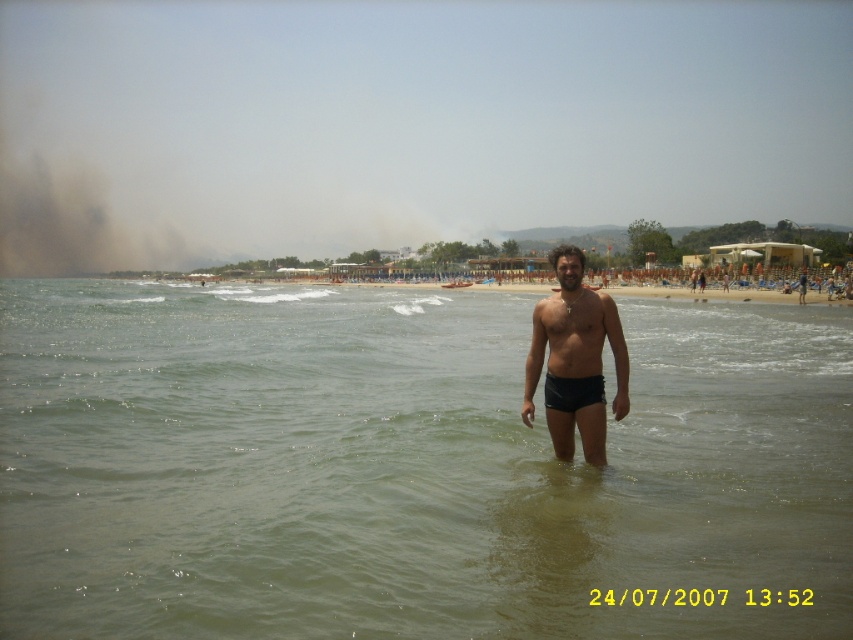
You are a lifeguard on duty and you see a swimmer in the greenish water at center and a person wearing black matte shorts at center. Which object is wider?

The greenish water at center is wider than the black matte shorts at center according to the description.

Consider the image. You are a drone operator trying to capture a photo of the beach scene. You need to ensure that both the point at coordinates point (247, 289) and point (602, 321) are visible in the frame. Given their spatial relationship, which point should be placed closer to the front of the image to ensure both are in view?

Point (602, 321) should be placed closer to the front of the image because point (247, 289) is behind it, so positioning the closer point forward ensures both are visible.

You are a lifeguard on duty and need to assess the safety of the swimmer in the water. Based on the image, is the greenish water at center closer to the shore or further out compared to the black matte shorts at center?

The greenish water at center is in front of the black matte shorts at center, meaning it is closer to the shore since the water is where the person wearing the black matte shorts is wading into.